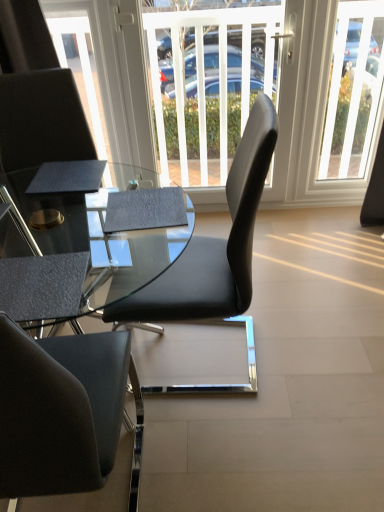
Find the location of a particular element. Image resolution: width=384 pixels, height=512 pixels. free space in front of black leather chair at center, which is the 2th chair from left to right is located at coordinates (249, 456).